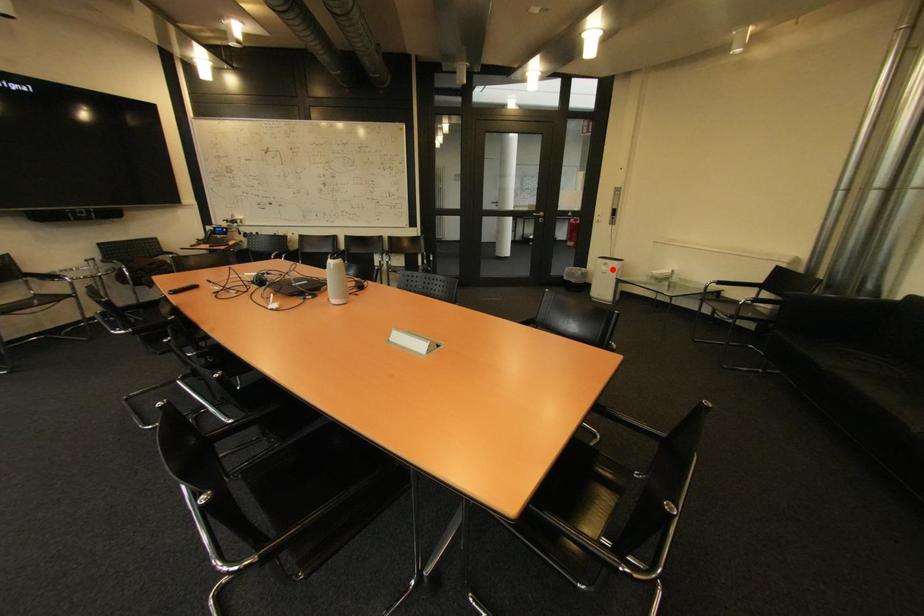
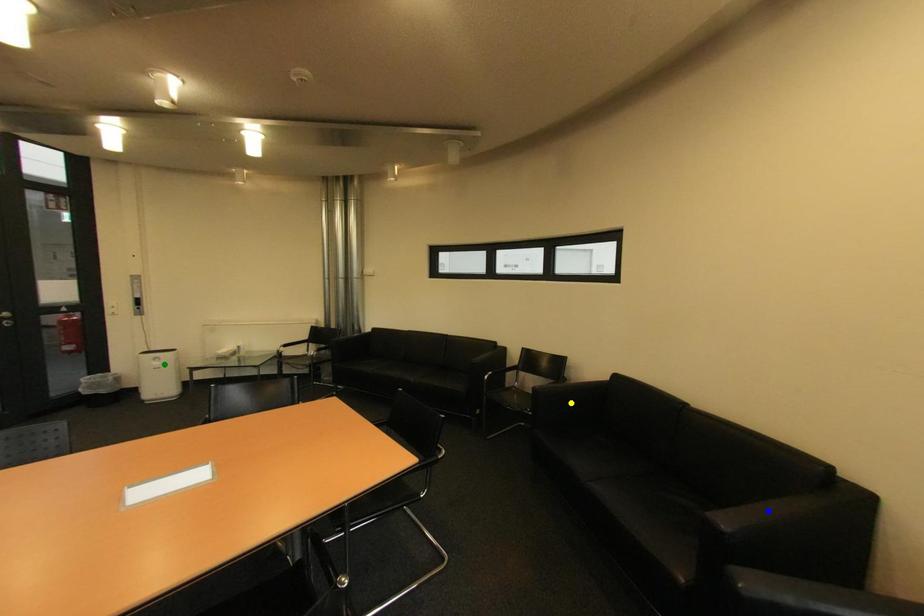
Question: I am providing you with two images of the same scene from different viewpoints. A red point is marked on the first image. You are given multiple points on the second image. Can you choose the point in image 2 that corresponds to the point in image 1?

Choices:
 (A) yellow point
 (B) green point
 (C) blue point

Answer: (B)